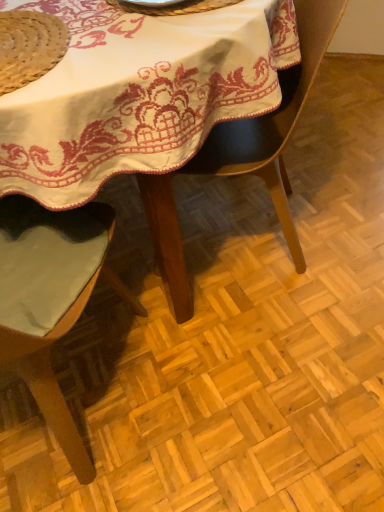
The width and height of the screenshot is (384, 512). I want to click on vacant space to the right of black leather chair at center, the second chair in the left-to-right sequence, so click(x=340, y=206).